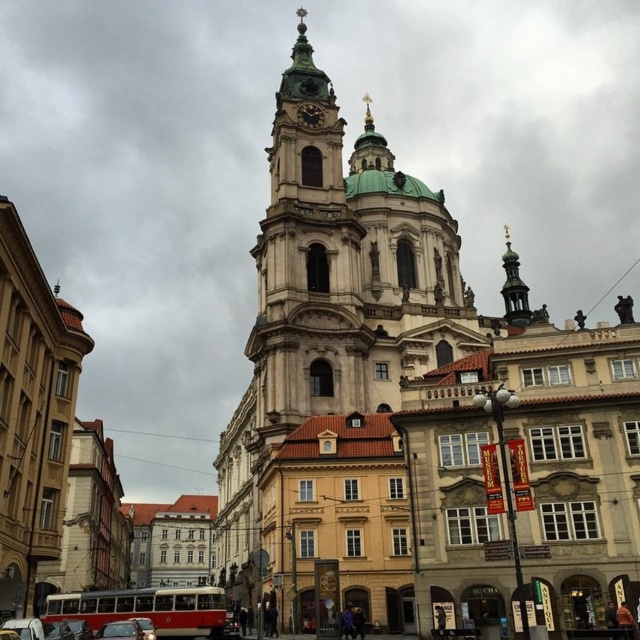
You are a delivery person needing to park your 2.5 meters wide truck. You see the red painted metal bus at lower left and the metallic silver car at lower left in the image. Which vehicle should you park next to if you need space for your truck?

The red painted metal bus at lower left might be wider than metallic silver car at lower left, so parking next to the metallic silver car at lower left would provide more space for your truck.

You are a tourist standing in front of the historic church and want to take a photo of both the red painted metal bus at lower left and the metallic silver car at lower left. Which one should you point your camera towards first to ensure both are in frame?

You should point your camera towards the red painted metal bus at lower left first because it is positioned lower than the metallic silver car at lower left, so adjusting the angle to include both would require framing from the lower to the upper part of the scene.